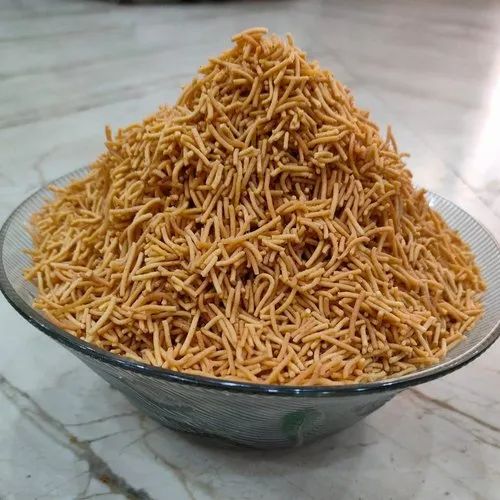
This screenshot has width=500, height=500. Find the location of `the right edge of bowl`. the right edge of bowl is located at coordinates (492, 300).